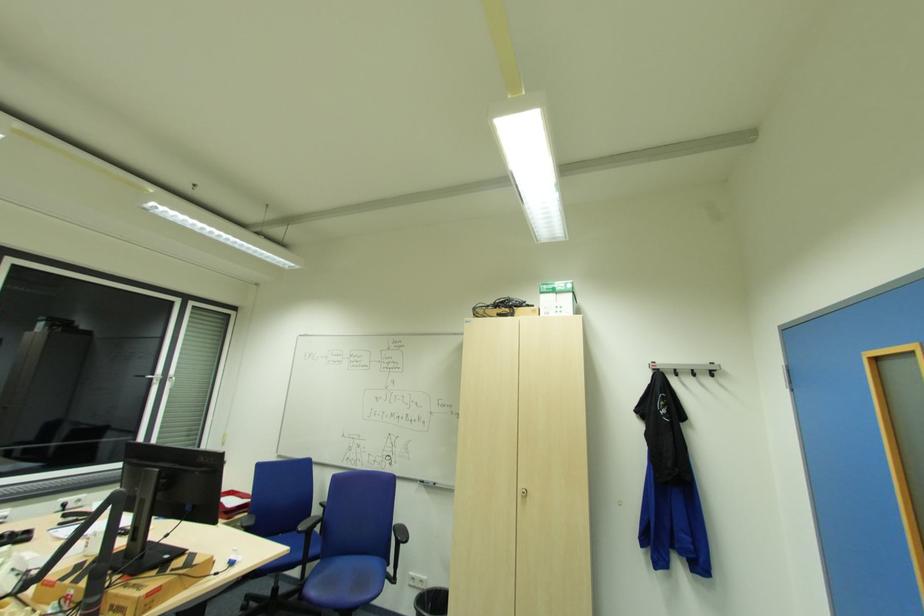
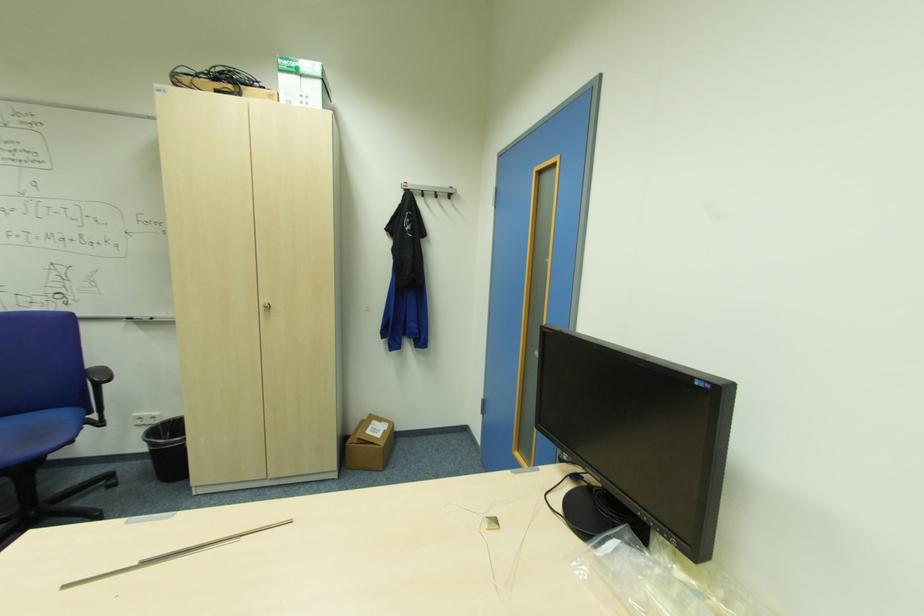
Find the pixel in the second image that matches pixel 695 370 in the first image.

(439, 192)